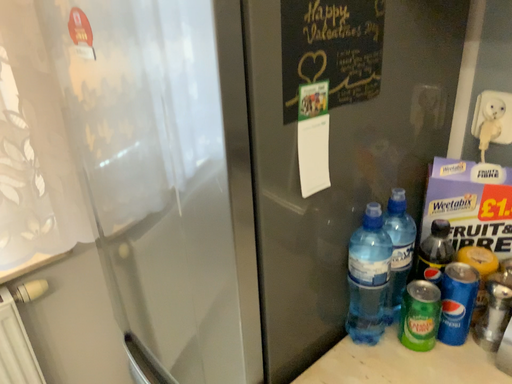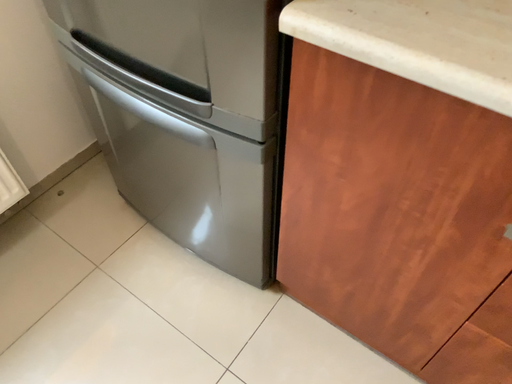
Question: How did the camera likely rotate when shooting the video?

Choices:
 (A) rotated downward
 (B) rotated upward

Answer: (A)